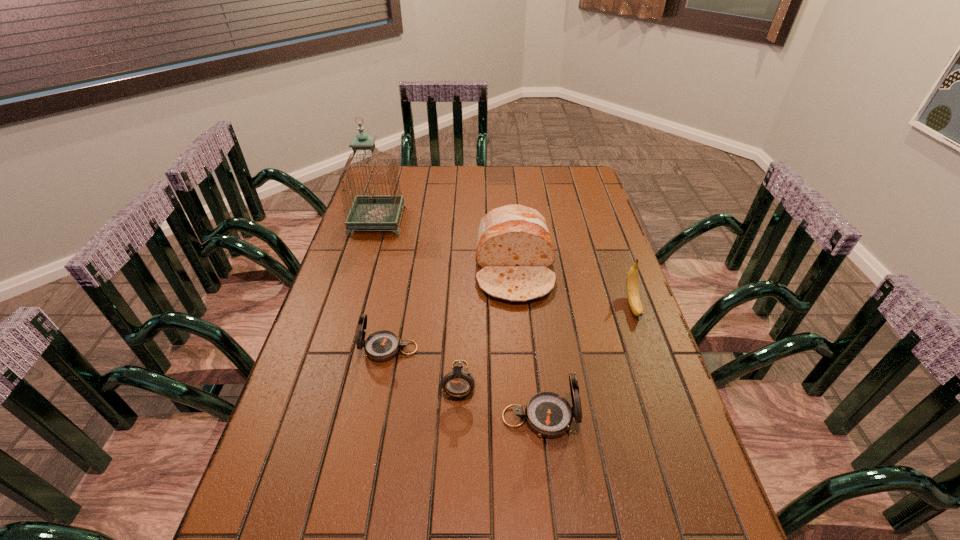
Find the location of a particular element. the second shortest compass is located at coordinates (383, 345).

Where is `the second compass from left to right`? the second compass from left to right is located at coordinates (458, 383).

This screenshot has height=540, width=960. I want to click on the shortest object, so click(x=458, y=383).

At what (x,y) coordinates should I click in order to perform the action: click on the rightmost compass. Please return your answer as a coordinate pair (x, y). This screenshot has height=540, width=960. Looking at the image, I should click on (548, 414).

The image size is (960, 540). I want to click on birdcage, so click(x=371, y=211).

The height and width of the screenshot is (540, 960). Identify the location of the farthest object. (371, 211).

The height and width of the screenshot is (540, 960). What are the coordinates of `bread` in the screenshot? It's located at (514, 248).

Find the location of a particular element. This screenshot has height=540, width=960. banana is located at coordinates (632, 288).

The image size is (960, 540). In order to click on vacant space located 0.050m on the face of the second tallest compass in this screenshot , I will do `click(342, 349)`.

Locate an element on the screen. free region located on the face of the second tallest compass is located at coordinates (312, 349).